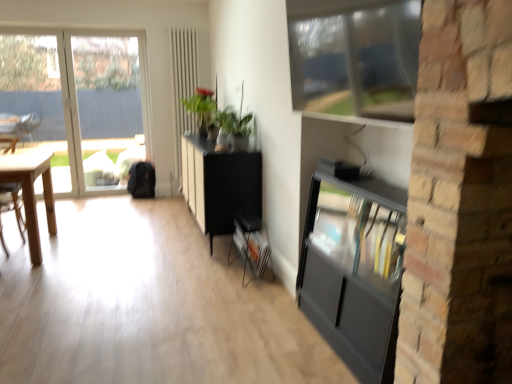
Question: Is transparent glass window at left, which is the 1th window in left-to-right order, inside light wood desk at left?

Choices:
 (A) no
 (B) yes

Answer: (A)

Question: Is the position of light wood desk at left more distant than that of transparent glass window at left, which is the second window from front to back?

Choices:
 (A) no
 (B) yes

Answer: (A)

Question: Does light wood desk at left have a lesser width compared to transparent glass window at left, which is the 1th window in left-to-right order?

Choices:
 (A) no
 (B) yes

Answer: (A)

Question: Is light wood desk at left located outside transparent glass window at left, which is the second window from front to back?

Choices:
 (A) no
 (B) yes

Answer: (B)

Question: From the image's perspective, is light wood desk at left below transparent glass window at left, marked as the 1th window in a back-to-front arrangement?

Choices:
 (A) yes
 (B) no

Answer: (A)

Question: Looking at their shapes, would you say black matte cabinet at center is wider or thinner than matte black cabinet at right?

Choices:
 (A) wide
 (B) thin

Answer: (A)

Question: Is black matte cabinet at center inside the boundaries of matte black cabinet at right, or outside?

Choices:
 (A) outside
 (B) inside

Answer: (A)

Question: From a real-world perspective, is black matte cabinet at center physically located above or below matte black cabinet at right?

Choices:
 (A) above
 (B) below

Answer: (A)

Question: Based on their sizes in the image, would you say black matte cabinet at center is bigger or smaller than matte black cabinet at right?

Choices:
 (A) small
 (B) big

Answer: (B)

Question: From their relative heights in the image, would you say clear glass window at upper center, the 2th window from the back, is taller or shorter than black matte cabinet at center?

Choices:
 (A) tall
 (B) short

Answer: (B)

Question: Considering the relative positions of clear glass window at upper center, the 1th window from the front, and black matte cabinet at center in the image provided, is clear glass window at upper center, the 1th window from the front, to the left or to the right of black matte cabinet at center?

Choices:
 (A) left
 (B) right

Answer: (B)

Question: From a real-world perspective, is clear glass window at upper center, positioned as the 2th window in left-to-right order, positioned above or below black matte cabinet at center?

Choices:
 (A) below
 (B) above

Answer: (B)

Question: From the image's perspective, relative to black matte cabinet at center, is clear glass window at upper center, positioned as the 2th window in left-to-right order, above or below?

Choices:
 (A) below
 (B) above

Answer: (B)

Question: From a real-world perspective, is metallic gray magazine rack at center positioned above or below transparent glass window at left, the 2th window viewed from the right?

Choices:
 (A) below
 (B) above

Answer: (A)

Question: Is metallic gray magazine rack at center inside the boundaries of transparent glass window at left, which is the second window from front to back, or outside?

Choices:
 (A) outside
 (B) inside

Answer: (A)